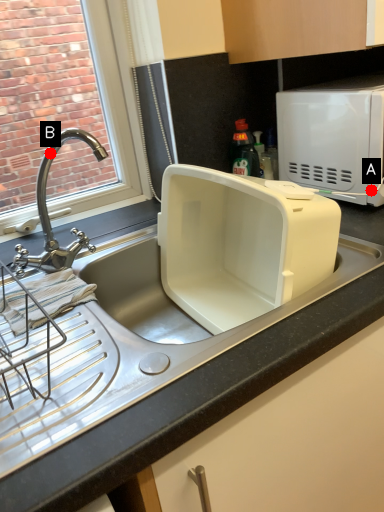
Question: Two points are circled on the image, labeled by A and B beside each circle. Which point is closer to the camera taking this photo?

Choices:
 (A) A is closer
 (B) B is closer

Answer: (A)